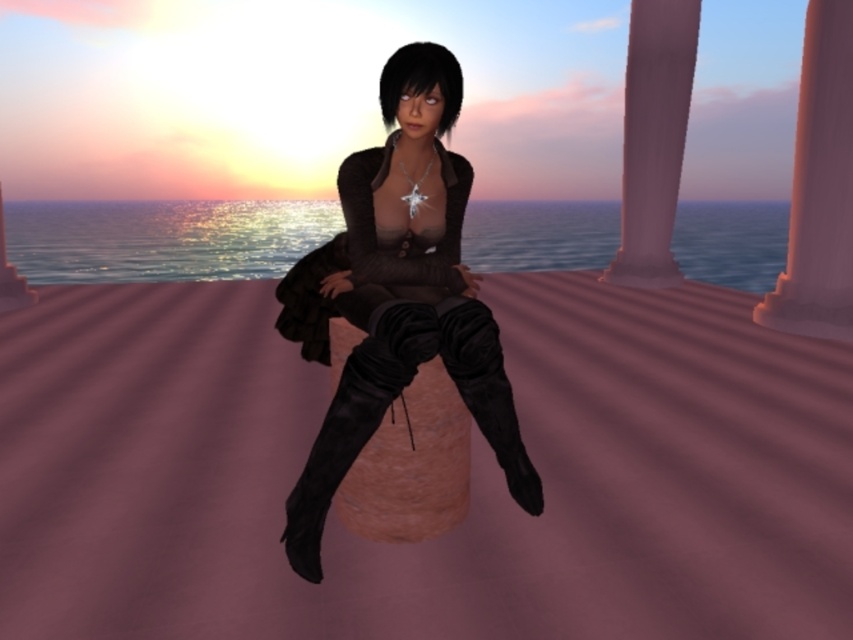
Is point (310, 552) in front of point (830, 166)?

Yes.

Who is more distant from viewer, [422,237] or [810,172]?

The point [810,172] is more distant.

Describe the element at coordinates (397, 296) in the screenshot. I see `matte black boots at center` at that location.

Find the location of a particular element. The width and height of the screenshot is (853, 640). matte black boots at center is located at coordinates (397, 296).

Does smooth pink stone pillar at right appear under pink marble pillar at upper right?

Yes.

Measure the distance between smooth pink stone pillar at right and camera.

smooth pink stone pillar at right is 17.42 feet from camera.

Identify the location of smooth pink stone pillar at right. (819, 186).

Is matte black boots at center bigger than pink marble pillar at upper right?

No.

Is matte black boots at center to the left of pink marble pillar at upper right from the viewer's perspective?

Yes, matte black boots at center is to the left of pink marble pillar at upper right.

Who is more forward, (376, 317) or (689, 100)?

Point (376, 317) is more forward.

Identify the location of matte black boots at center. This screenshot has width=853, height=640. (397, 296).